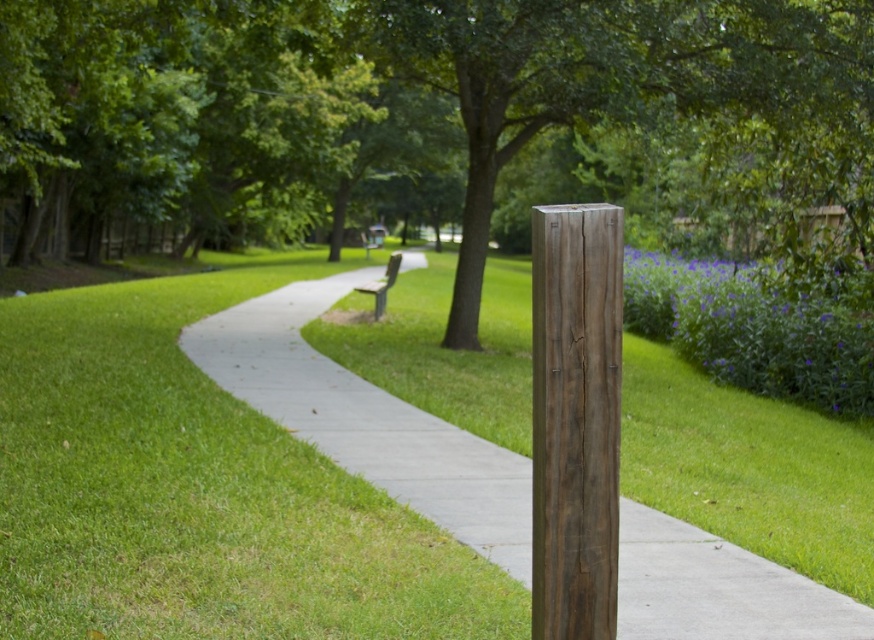
Question: Is gray concrete pavement at center further to camera compared to wooden bench at center?

Choices:
 (A) yes
 (B) no

Answer: (B)

Question: Which point appears closest to the camera in this image?

Choices:
 (A) (588, 577)
 (B) (380, 284)
 (C) (251, 385)

Answer: (A)

Question: Is gray concrete pavement at center positioned before wooden bench at center?

Choices:
 (A) no
 (B) yes

Answer: (B)

Question: Which of the following is the closest to the observer?

Choices:
 (A) (549, 257)
 (B) (394, 280)

Answer: (A)

Question: Which of the following is the closest to the observer?

Choices:
 (A) (567, 600)
 (B) (380, 314)
 (C) (442, 506)

Answer: (A)

Question: In this image, where is gray concrete pavement at center located relative to wooden bench at center?

Choices:
 (A) left
 (B) right

Answer: (B)